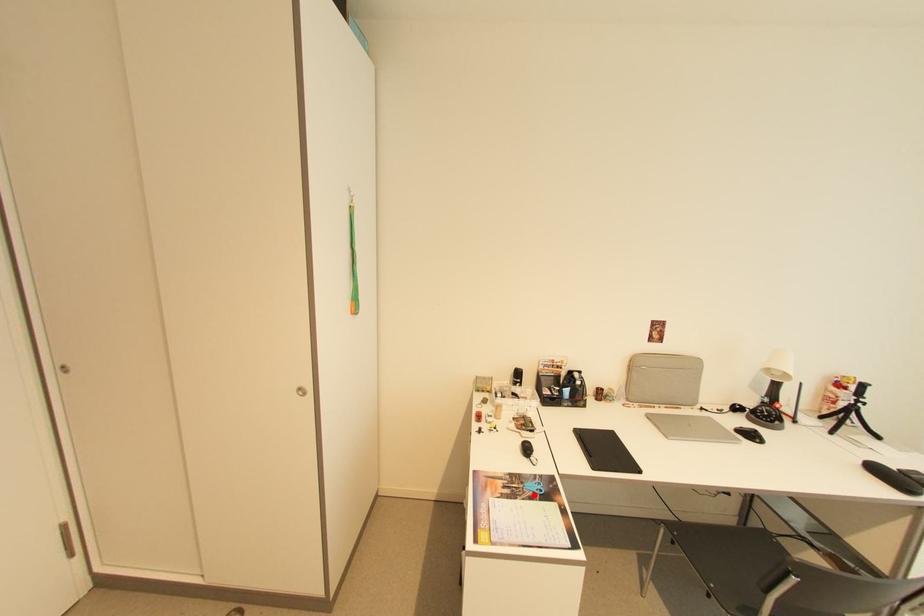
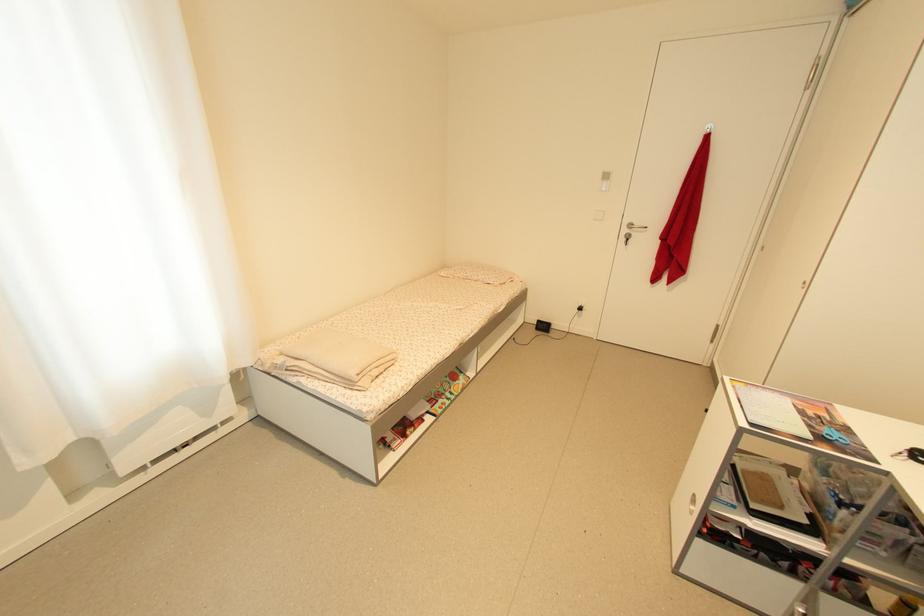
Where in the second image is the point corresponding to the highlighted location from the first image?

(822, 429)